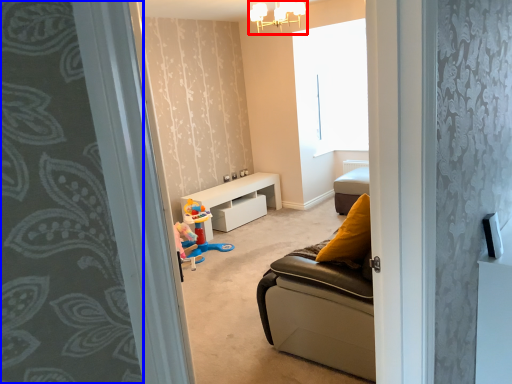
Question: Among these objects, which one is farthest to the camera, light fixture (highlighted by a red box) or curtain (highlighted by a blue box)?

Choices:
 (A) light fixture
 (B) curtain

Answer: (A)